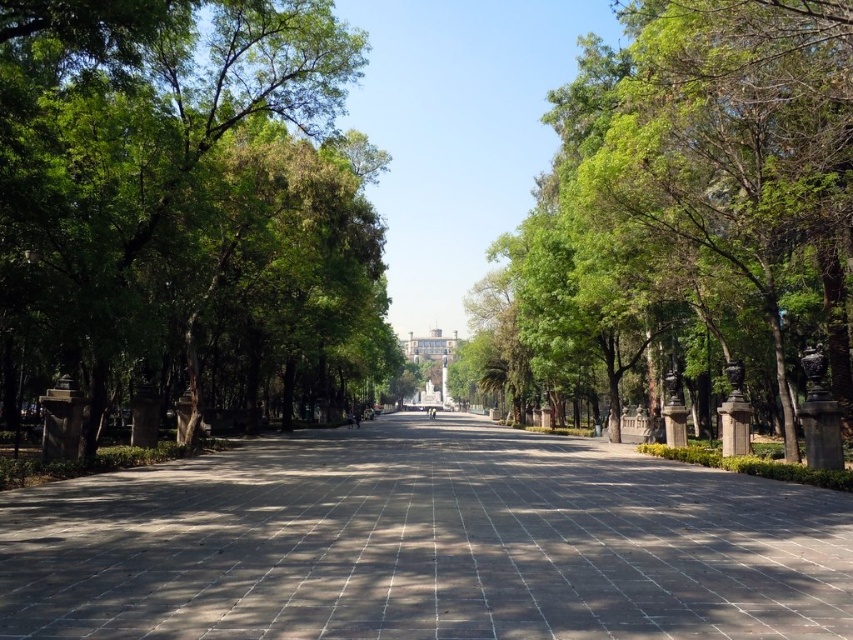
You are standing in the plaza and want to place a small potted plant exactly where the dark gray paving stone at center is located. However, you also notice the green leafy tree at center nearby. Considering their sizes, will the potted plant fit without overlapping the tree?

The dark gray paving stone at center has a smaller size compared to the green leafy tree at center. Since the potted plant is meant to be placed on the stone, which is smaller than the tree, the plant may not fit without overlapping the tree. Check the stone size first.

You are standing in the plaza and want to take a photo of the dark gray paving stone at center and the green leafy tree at center. Which object will appear larger in the photo?

The green leafy tree at center will appear larger in the photo because it is taller than the dark gray paving stone at center.